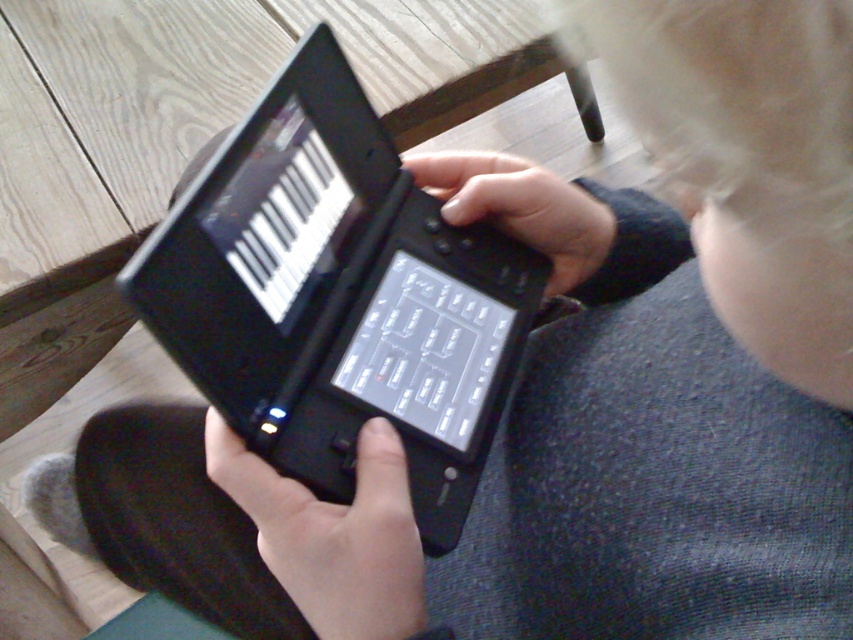
You are a musician trying to reach the black matte hand at center while holding the black matte laptop at center. Can you move the laptop to the right side to make space?

The black matte laptop at center is to the left of the black matte hand at center, so moving it further to the right would place it under or beside the hand, potentially creating space depending on the available area.

You are a musician trying to adjust the settings on your device. You notice a black matte button at center and a black matte hand at center. Which object is wider?

The black matte hand at center is wider than the black matte button at center.